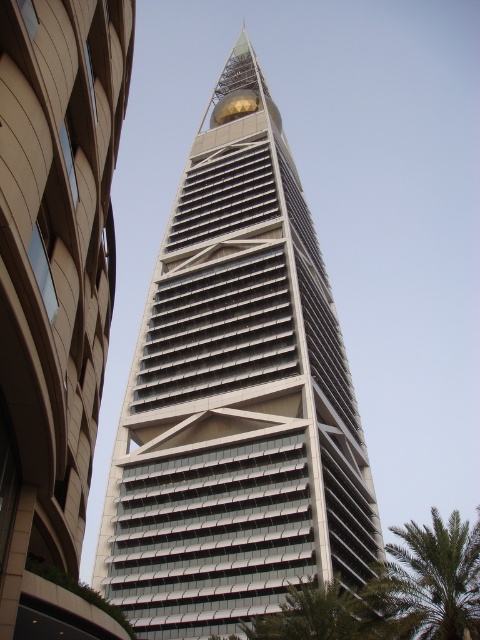
Question: Observing the image, what is the correct spatial positioning of white glass skyscraper at center in reference to green leafy palm tree at lower right?

Choices:
 (A) below
 (B) above

Answer: (B)

Question: Does white glass skyscraper at center have a smaller size compared to green leafy palm tree at lower right?

Choices:
 (A) no
 (B) yes

Answer: (B)

Question: Where is white glass skyscraper at center located in relation to green leafy palm tree at lower right in the image?

Choices:
 (A) left
 (B) right

Answer: (A)

Question: Which point is farther from the camera taking this photo?

Choices:
 (A) (181, 563)
 (B) (423, 605)

Answer: (A)

Question: Which point is farther from the camera taking this photo?

Choices:
 (A) (384, 604)
 (B) (121, 483)

Answer: (B)